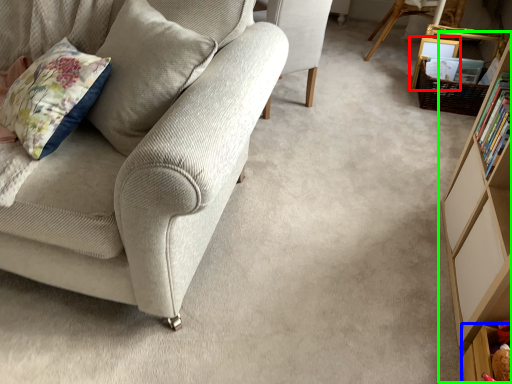
Question: Which object is the closest to the picture frame (highlighted by a red box)? Choose among these: shelf (highlighted by a blue box) or bookcase (highlighted by a green box).

Choices:
 (A) shelf
 (B) bookcase

Answer: (B)